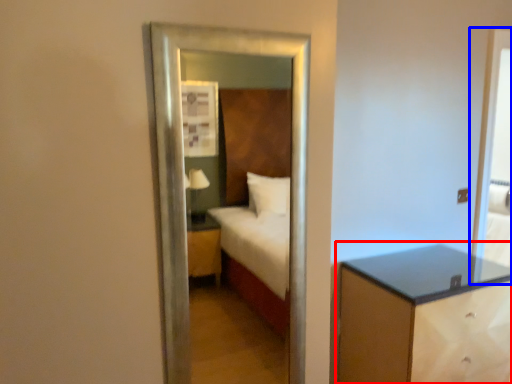
Question: Which object is further to the camera taking this photo, nightstand (highlighted by a red box) or screen door (highlighted by a blue box)?

Choices:
 (A) nightstand
 (B) screen door

Answer: (B)